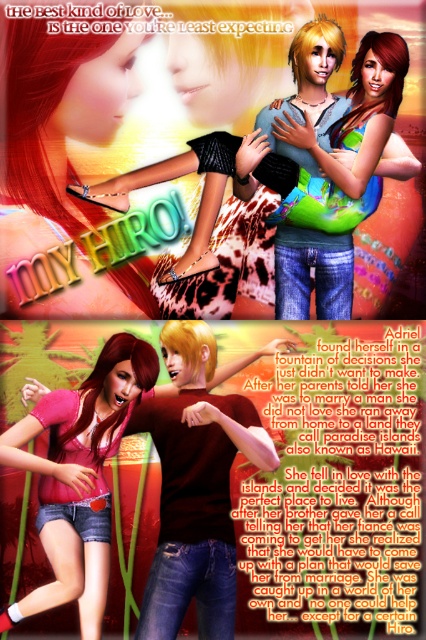
Based on the image description, which clothing item is positioned higher vertically between the shiny green bikini top at center and the matte pink shirt at center?

The shiny green bikini top at center is positioned higher vertically than the matte pink shirt at center.

You are a fashion designer looking at the image. You need to decide which item is taller between the denim shorts at lower left and the shiny green bikini top at center. Which one is taller?

The denim shorts at lower left is taller than the shiny green bikini top at center according to the description.

You are standing at the bottom half of the image where the tropical scene is. There is a point marked at coordinates (78, 477). What object is located at that point?

The object at point (78, 477) is denim shorts at lower left.